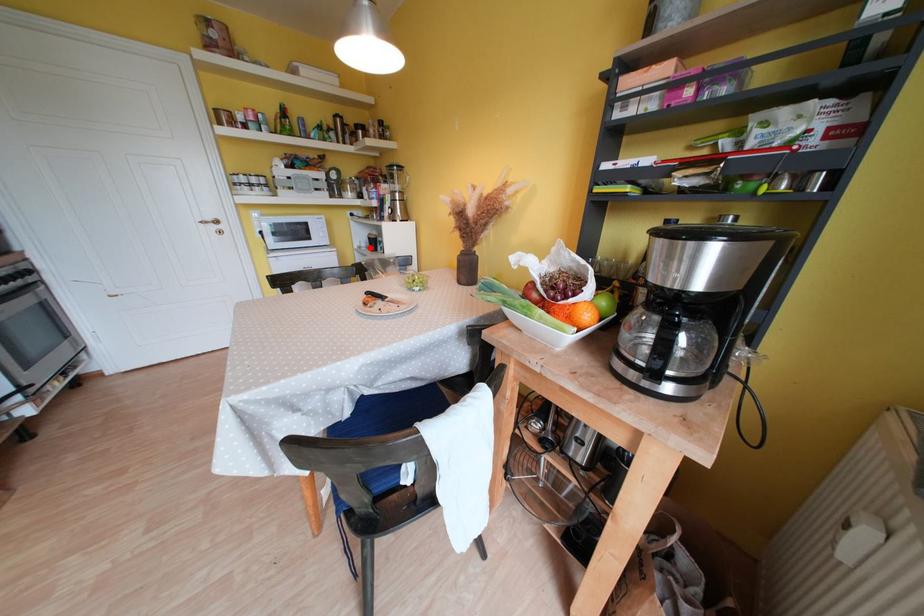
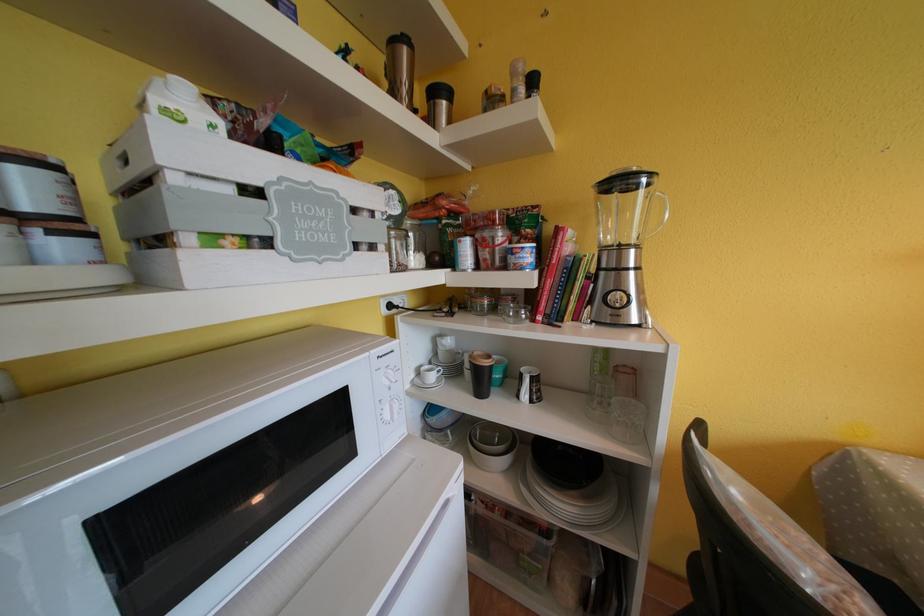
Find the pixel in the second image that matches the highlighted location in the first image.

(439, 381)